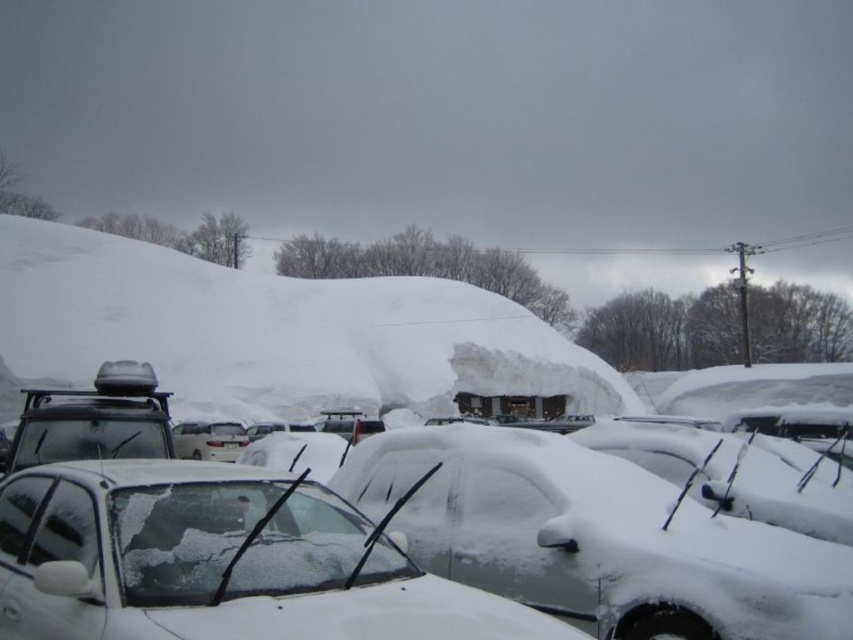
Between white matte car at center and white fluffy snow at upper center, which one has more height?

Answer: With more height is white fluffy snow at upper center.

Is white matte car at center to the left of white fluffy snow at upper center from the viewer's perspective?

In fact, white matte car at center is to the right of white fluffy snow at upper center.

Where is `white matte car at center`? Image resolution: width=853 pixels, height=640 pixels. white matte car at center is located at coordinates (593, 538).

Between point (293, 371) and point (244, 600), which one is positioned in front?

Point (244, 600)

Is white fluffy snow at upper center shorter than snow-covered car at center?

No.

What do you see at coordinates (277, 333) in the screenshot?
I see `white fluffy snow at upper center` at bounding box center [277, 333].

I want to click on white fluffy snow at upper center, so click(x=277, y=333).

Between point (550, 557) and point (39, 540), which one is positioned behind?

Point (550, 557)

Between white matte car at center and snow-covered car at center, which one is positioned lower?

white matte car at center

Is point (433, 476) behind point (97, 625)?

Yes, point (433, 476) is behind point (97, 625).

The image size is (853, 640). I want to click on white matte car at center, so click(593, 538).